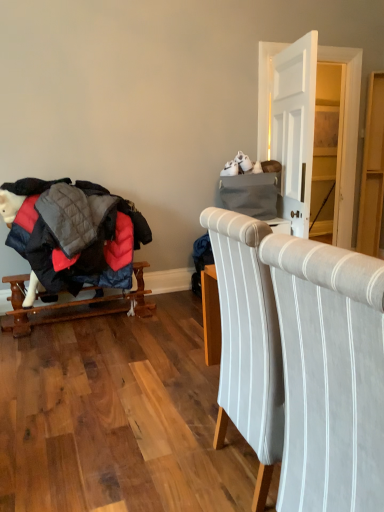
You are a GUI agent. You are given a task and a screenshot of the screen. Output one action in this format:
    pyautogui.click(x=<x>, y=<y>)
    Task: Click on the light wood dresser at right, which appears as the second dresser when viewed from the left
    Image resolution: width=384 pixels, height=512 pixels.
    Given the screenshot: What is the action you would take?
    pyautogui.click(x=372, y=170)

Is wooden rocking horse at left positioned beyond the bounds of light wood dresser at right, which appears as the second dresser when viewed from the left?

Indeed, wooden rocking horse at left is completely outside light wood dresser at right, which appears as the second dresser when viewed from the left.

Which is less distant, (56, 309) or (371, 162)?

Point (56, 309) is positioned closer to the camera compared to point (371, 162).

Does wooden rocking horse at left have a greater height compared to light wood dresser at right, the first dresser in the right-to-left sequence?

No.

Can you confirm if wooden rocking horse at left is smaller than light gray striped fabric chair at center?

Yes.

From the image's perspective, relative to light gray striped fabric chair at center, is wooden rocking horse at left above or below?

Clearly, from the image's perspective, wooden rocking horse at left is above light gray striped fabric chair at center.

Which object is positioned more to the left, wooden rocking horse at left or light gray striped fabric chair at center?

From the viewer's perspective, wooden rocking horse at left appears more on the left side.

Which point is more distant from viewer, (7, 281) or (315, 480)?

The point (7, 281) is behind.

Considering the sizes of objects wooden rocking horse at left and matte gray dresser at upper right, the 2th dresser when ordered from right to left, in the image provided, who is bigger, wooden rocking horse at left or matte gray dresser at upper right, the 2th dresser when ordered from right to left,?

Bigger between the two is wooden rocking horse at left.

Can you confirm if wooden rocking horse at left is taller than matte gray dresser at upper right, arranged as the 1th dresser when viewed from the left?

Incorrect, the height of wooden rocking horse at left is not larger of that of matte gray dresser at upper right, arranged as the 1th dresser when viewed from the left.

Would you say wooden rocking horse at left contains matte gray dresser at upper right, the 2th dresser when ordered from right to left?

That's incorrect, matte gray dresser at upper right, the 2th dresser when ordered from right to left, is not inside wooden rocking horse at left.

Does wooden rocking horse at left come in front of matte gray dresser at upper right, arranged as the 1th dresser when viewed from the left?

That is True.

Considering the relative sizes of light gray striped fabric chair at center and matte gray dresser at upper right, arranged as the 1th dresser when viewed from the left, in the image provided, is light gray striped fabric chair at center wider than matte gray dresser at upper right, arranged as the 1th dresser when viewed from the left,?

Yes, light gray striped fabric chair at center is wider than matte gray dresser at upper right, arranged as the 1th dresser when viewed from the left.

Is the surface of light gray striped fabric chair at center in direct contact with matte gray dresser at upper right, the 2th dresser when ordered from right to left?

No, light gray striped fabric chair at center is not making contact with matte gray dresser at upper right, the 2th dresser when ordered from right to left.

Is light gray striped fabric chair at center to the right of matte gray dresser at upper right, the 2th dresser when ordered from right to left, from the viewer's perspective?

In fact, light gray striped fabric chair at center is to the left of matte gray dresser at upper right, the 2th dresser when ordered from right to left.

From a real-world perspective, is light gray striped fabric chair at center under matte gray dresser at upper right, arranged as the 1th dresser when viewed from the left?

Correct, in the physical world, light gray striped fabric chair at center is lower than matte gray dresser at upper right, arranged as the 1th dresser when viewed from the left.

Is the depth of light wood dresser at right, the first dresser in the right-to-left sequence, less than that of wooden rocking horse at left?

No, it is not.

Can you confirm if light wood dresser at right, which appears as the second dresser when viewed from the left, is shorter than wooden rocking horse at left?

Incorrect, the height of light wood dresser at right, which appears as the second dresser when viewed from the left, does not fall short of that of wooden rocking horse at left.

Is there a large distance between light wood dresser at right, the first dresser in the right-to-left sequence, and wooden rocking horse at left?

That's right, there is a large distance between light wood dresser at right, the first dresser in the right-to-left sequence, and wooden rocking horse at left.

Between light wood dresser at right, which appears as the second dresser when viewed from the left, and light gray striped fabric chair at center, which one has less height?

Standing shorter between the two is light gray striped fabric chair at center.

Considering the sizes of objects light wood dresser at right, which appears as the second dresser when viewed from the left, and light gray striped fabric chair at center in the image provided, who is thinner, light wood dresser at right, which appears as the second dresser when viewed from the left, or light gray striped fabric chair at center?

With smaller width is light wood dresser at right, which appears as the second dresser when viewed from the left.

From a real-world perspective, between light wood dresser at right, which appears as the second dresser when viewed from the left, and light gray striped fabric chair at center, who is vertically higher?

light wood dresser at right, which appears as the second dresser when viewed from the left.

Is the surface of light wood dresser at right, the first dresser in the right-to-left sequence, in direct contact with light gray striped fabric chair at center?

No, light wood dresser at right, the first dresser in the right-to-left sequence, is not making contact with light gray striped fabric chair at center.

Does matte gray dresser at upper right, arranged as the 1th dresser when viewed from the left, have a greater height compared to light wood dresser at right, the first dresser in the right-to-left sequence?

Indeed, matte gray dresser at upper right, arranged as the 1th dresser when viewed from the left, has a greater height compared to light wood dresser at right, the first dresser in the right-to-left sequence.

Is matte gray dresser at upper right, arranged as the 1th dresser when viewed from the left, placed right next to light wood dresser at right, which appears as the second dresser when viewed from the left?

No, matte gray dresser at upper right, arranged as the 1th dresser when viewed from the left, is not next to light wood dresser at right, which appears as the second dresser when viewed from the left.

Considering the sizes of objects matte gray dresser at upper right, arranged as the 1th dresser when viewed from the left, and light wood dresser at right, the first dresser in the right-to-left sequence, in the image provided, who is bigger, matte gray dresser at upper right, arranged as the 1th dresser when viewed from the left, or light wood dresser at right, the first dresser in the right-to-left sequence,?

matte gray dresser at upper right, arranged as the 1th dresser when viewed from the left, is bigger.

Between matte gray dresser at upper right, the 2th dresser when ordered from right to left, and light wood dresser at right, the first dresser in the right-to-left sequence, which one appears on the left side from the viewer's perspective?

Positioned to the left is matte gray dresser at upper right, the 2th dresser when ordered from right to left.

Starting from the wooden rocking horse at left, which dresser is the 2nd one to the right? Please provide its 2D coordinates.

[(372, 170)]

Where is `chair below the wooden rocking horse at left (from the image's perspective)`? The height and width of the screenshot is (512, 384). chair below the wooden rocking horse at left (from the image's perspective) is located at coordinates (330, 374).

Based on their spatial positions, is light gray striped fabric chair at center or wooden rocking horse at left further from light wood dresser at right, the first dresser in the right-to-left sequence?

light gray striped fabric chair at center.

Estimate the real-world distances between objects in this image. Which object is further from light gray striped fabric chair at center, wooden rocking horse at left or light wood dresser at right, the first dresser in the right-to-left sequence?

light wood dresser at right, the first dresser in the right-to-left sequence, is positioned further to the anchor light gray striped fabric chair at center.

Estimate the real-world distances between objects in this image. Which object is further from light gray striped fabric chair at center, matte gray dresser at upper right, arranged as the 1th dresser when viewed from the left, or wooden rocking horse at left?

Based on the image, matte gray dresser at upper right, arranged as the 1th dresser when viewed from the left, appears to be further to light gray striped fabric chair at center.

Looking at the image, which one is located further to light wood dresser at right, the first dresser in the right-to-left sequence, wooden rocking horse at left or light gray striped fabric chair at center?

Among the two, light gray striped fabric chair at center is located further to light wood dresser at right, the first dresser in the right-to-left sequence.

Which object lies nearer to the anchor point wooden rocking horse at left, matte gray dresser at upper right, arranged as the 1th dresser when viewed from the left, or light wood dresser at right, the first dresser in the right-to-left sequence?

The object closer to wooden rocking horse at left is light wood dresser at right, the first dresser in the right-to-left sequence.

Considering their positions, is light gray striped fabric chair at center positioned further to wooden rocking horse at left than matte gray dresser at upper right, arranged as the 1th dresser when viewed from the left?

matte gray dresser at upper right, arranged as the 1th dresser when viewed from the left, is positioned further to the anchor wooden rocking horse at left.

Consider the image. Looking at the image, which one is located further to matte gray dresser at upper right, arranged as the 1th dresser when viewed from the left, light gray striped fabric chair at center or light wood dresser at right, which appears as the second dresser when viewed from the left?

The object further to matte gray dresser at upper right, arranged as the 1th dresser when viewed from the left, is light gray striped fabric chair at center.

When comparing their distances from matte gray dresser at upper right, arranged as the 1th dresser when viewed from the left, does wooden rocking horse at left or light gray striped fabric chair at center seem further?

light gray striped fabric chair at center lies further to matte gray dresser at upper right, arranged as the 1th dresser when viewed from the left, than the other object.

I want to click on furniture between light gray striped fabric chair at center and matte gray dresser at upper right, the 2th dresser when ordered from right to left, from front to back, so click(73, 305).

The height and width of the screenshot is (512, 384). What are the coordinates of `furniture positioned between light gray striped fabric chair at center and light wood dresser at right, which appears as the second dresser when viewed from the left, from near to far` in the screenshot? It's located at (73, 305).

Locate an element on the screen. dresser between wooden rocking horse at left and light wood dresser at right, which appears as the second dresser when viewed from the left, in the horizontal direction is located at coordinates [347, 131].

This screenshot has height=512, width=384. Find the location of `dresser located between light gray striped fabric chair at center and light wood dresser at right, the first dresser in the right-to-left sequence, in the depth direction`. dresser located between light gray striped fabric chair at center and light wood dresser at right, the first dresser in the right-to-left sequence, in the depth direction is located at coordinates (347, 131).